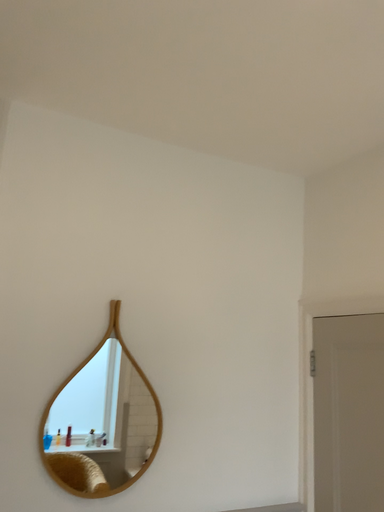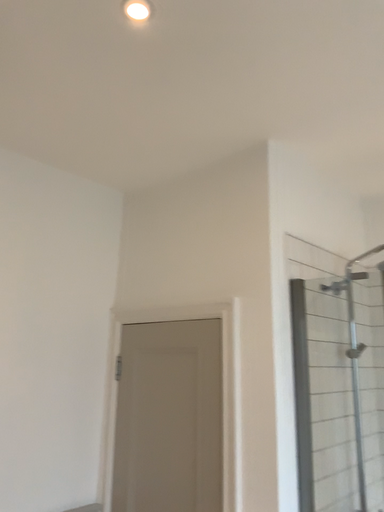
Question: How did the camera likely rotate when shooting the video?

Choices:
 (A) rotated right
 (B) rotated left

Answer: (A)